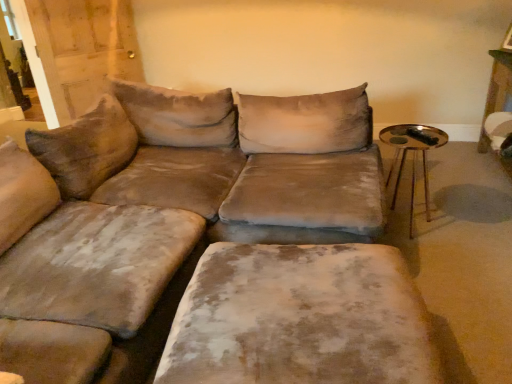
Question: From the image's perspective, is velvet beige couch at center above velvet beige ottoman at center?

Choices:
 (A) yes
 (B) no

Answer: (A)

Question: Is velvet beige couch at center oriented away from velvet beige ottoman at center?

Choices:
 (A) no
 (B) yes

Answer: (A)

Question: Considering the relative sizes of velvet beige couch at center and velvet beige ottoman at center in the image provided, is velvet beige couch at center taller than velvet beige ottoman at center?

Choices:
 (A) yes
 (B) no

Answer: (A)

Question: Is velvet beige couch at center placed right next to velvet beige ottoman at center?

Choices:
 (A) yes
 (B) no

Answer: (B)

Question: Does velvet beige couch at center appear on the right side of velvet beige ottoman at center?

Choices:
 (A) no
 (B) yes

Answer: (A)

Question: Is velvet beige couch at center inside or outside of velvet beige ottoman at center?

Choices:
 (A) inside
 (B) outside

Answer: (B)

Question: Based on their positions, is velvet beige couch at center located to the left or right of velvet beige ottoman at center?

Choices:
 (A) right
 (B) left

Answer: (B)

Question: In terms of width, does velvet beige couch at center look wider or thinner when compared to velvet beige ottoman at center?

Choices:
 (A) thin
 (B) wide

Answer: (B)

Question: Considering the positions of velvet beige couch at center and velvet beige ottoman at center in the image, is velvet beige couch at center taller or shorter than velvet beige ottoman at center?

Choices:
 (A) tall
 (B) short

Answer: (A)

Question: Considering the positions of velvet beige ottoman at center and gold metallic side table at right in the image, is velvet beige ottoman at center bigger or smaller than gold metallic side table at right?

Choices:
 (A) big
 (B) small

Answer: (A)

Question: Relative to gold metallic side table at right, is velvet beige ottoman at center in front or behind?

Choices:
 (A) front
 (B) behind

Answer: (A)

Question: In terms of width, does velvet beige ottoman at center look wider or thinner when compared to gold metallic side table at right?

Choices:
 (A) wide
 (B) thin

Answer: (A)

Question: From a real-world perspective, is velvet beige ottoman at center physically located above or below gold metallic side table at right?

Choices:
 (A) above
 (B) below

Answer: (B)

Question: Based on their sizes in the image, would you say velvet beige ottoman at center is bigger or smaller than velvet beige couch at center?

Choices:
 (A) big
 (B) small

Answer: (B)

Question: Is velvet beige ottoman at center in front of or behind velvet beige couch at center in the image?

Choices:
 (A) front
 (B) behind

Answer: (B)